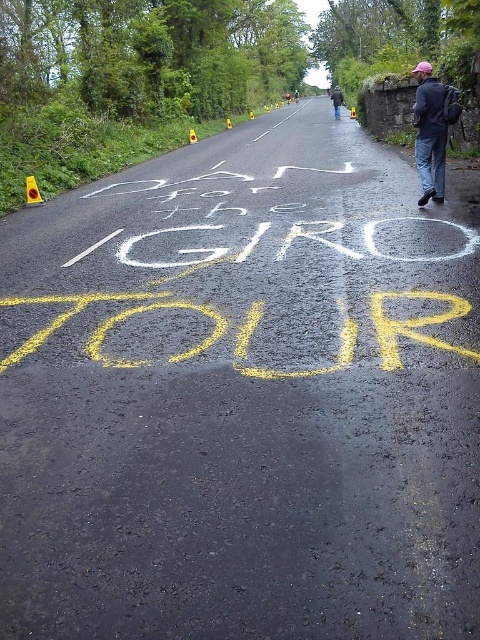
Between dark blue jacket at right and black jacket at center, which one appears on the left side from the viewer's perspective?

Positioned to the left is dark blue jacket at right.

Can you confirm if dark blue jacket at right is shorter than black jacket at center?

Yes, dark blue jacket at right is shorter than black jacket at center.

Between point (428, 157) and point (336, 84), which one is positioned behind?

Positioned behind is point (336, 84).

The width and height of the screenshot is (480, 640). Identify the location of dark blue jacket at right. (430, 132).